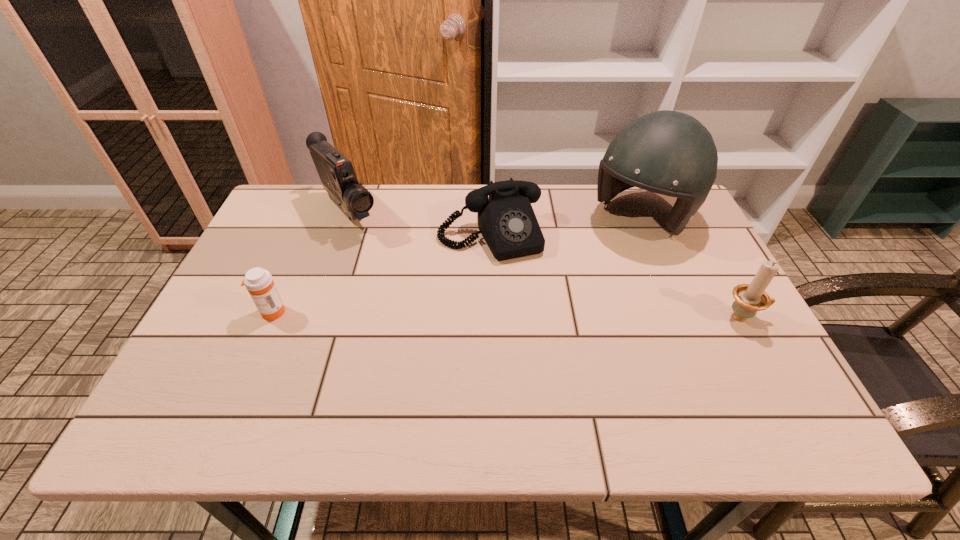
The image size is (960, 540). I want to click on candle_holder at the right edge, so click(x=750, y=298).

What are the coordinates of `football helmet that is positioned at the right edge` in the screenshot? It's located at (671, 153).

At what (x,y) coordinates should I click in order to perform the action: click on object present at the far left corner. Please return your answer as a coordinate pair (x, y). The height and width of the screenshot is (540, 960). Looking at the image, I should click on (336, 172).

At what (x,y) coordinates should I click in order to perform the action: click on object present at the far right corner. Please return your answer as a coordinate pair (x, y). This screenshot has height=540, width=960. Looking at the image, I should click on (671, 153).

In the image, there is a desktop. Identify the location of vacant space at the far edge. The width and height of the screenshot is (960, 540). [381, 203].

In the image, there is a desktop. What are the coordinates of `vacant space at the near edge` in the screenshot? It's located at (362, 389).

Where is `blank area at the left edge`? blank area at the left edge is located at coordinates (267, 348).

Locate an element on the screen. This screenshot has width=960, height=540. vacant space at the right edge of the desktop is located at coordinates (709, 331).

This screenshot has width=960, height=540. I want to click on free space at the far left corner of the desktop, so click(x=321, y=201).

This screenshot has height=540, width=960. Find the location of `empty space between the third shortest object and the football helmet`. empty space between the third shortest object and the football helmet is located at coordinates (692, 267).